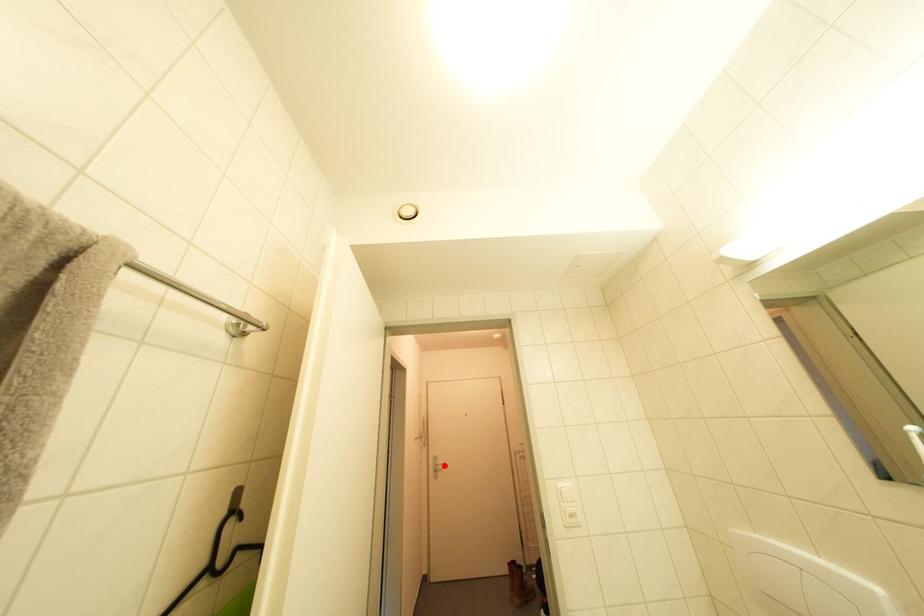
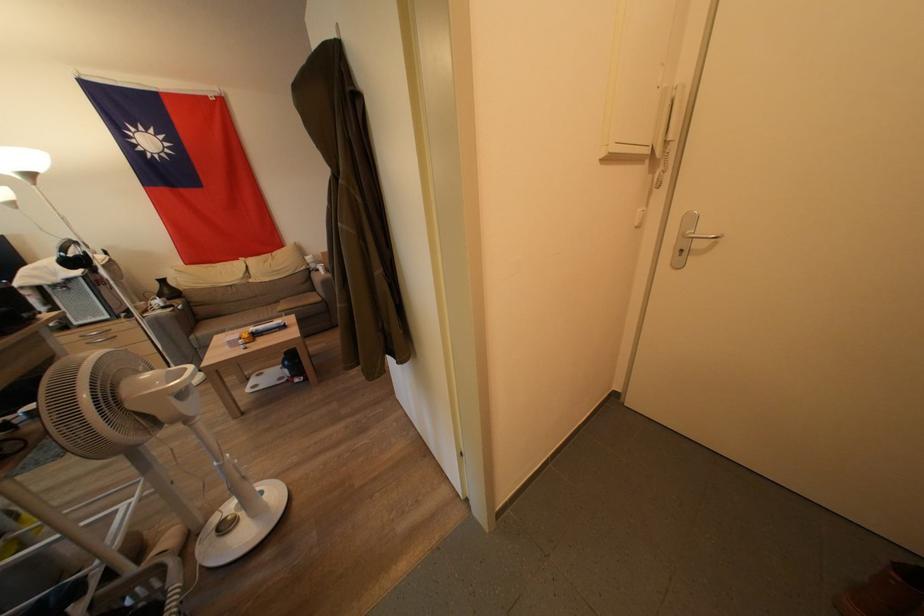
Question: A red point is marked in image1. In image2, is the corresponding 3D point closer to the camera or farther? Reply with the corresponding letter.

Choices:
 (A) The corresponding 3D point is closer.
 (B) The corresponding 3D point is farther.

Answer: (A)